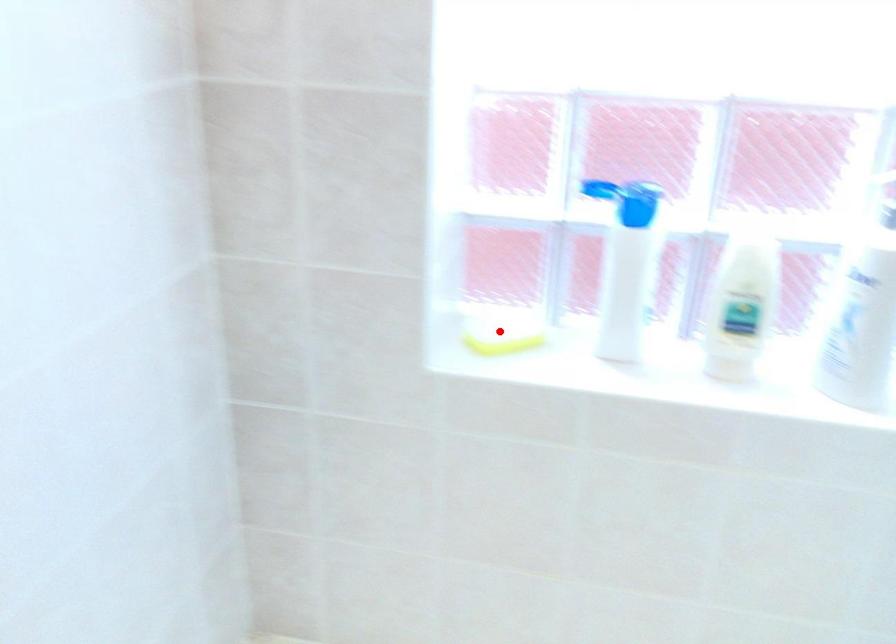
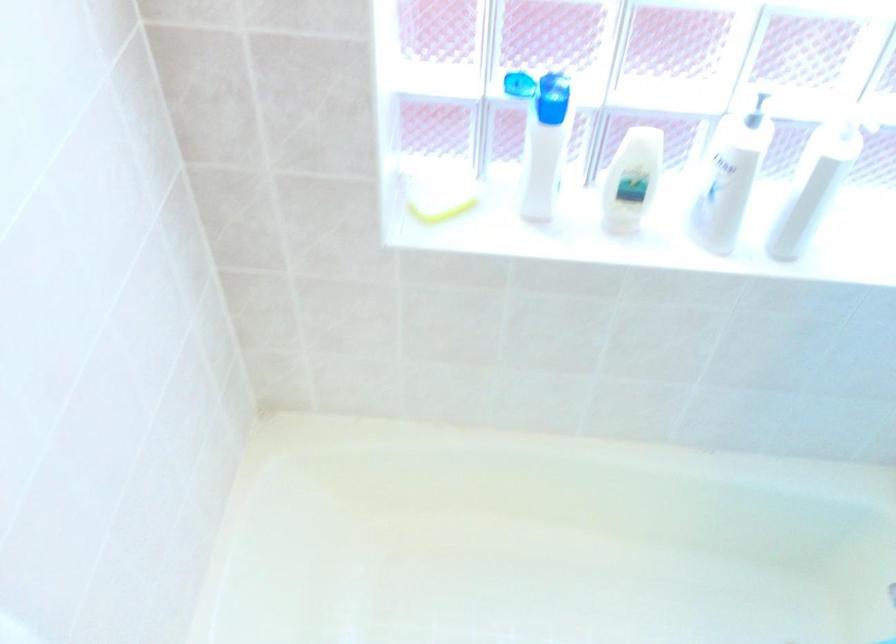
Question: I am providing you with two images of the same scene from different viewpoints. Image1 has a red point marked. In image2, the corresponding 3D location appears at what relative position? Reply with the corresponding letter.

Choices:
 (A) Closer
 (B) Farther

Answer: (B)